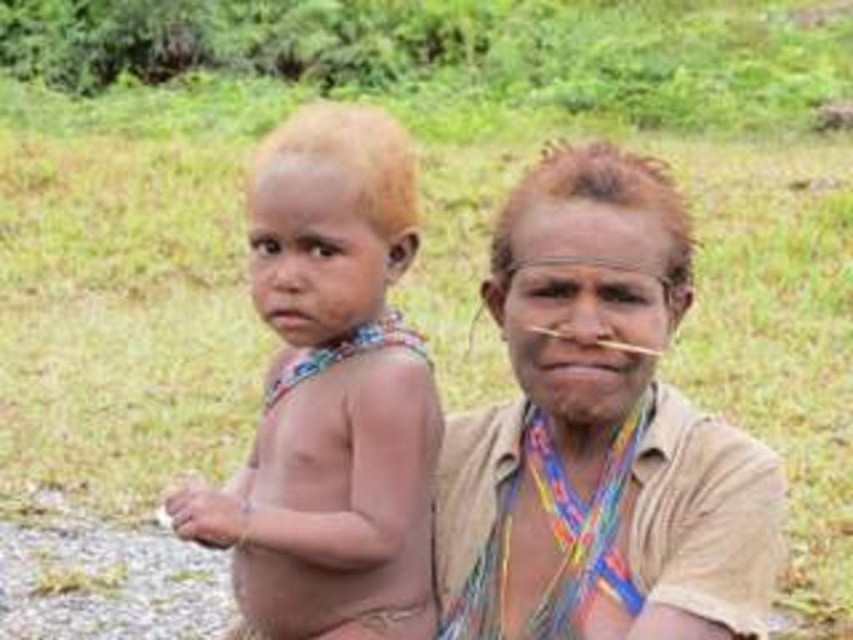
Question: Which of the following is the closest to the observer?

Choices:
 (A) 526,516
 (B) 369,588

Answer: (B)

Question: Does brown textured cloth at center have a greater width compared to light brown hair at center?

Choices:
 (A) no
 (B) yes

Answer: (B)

Question: Does brown textured cloth at center appear under light brown hair at center?

Choices:
 (A) no
 (B) yes

Answer: (B)

Question: Which point appears farthest from the camera in this image?

Choices:
 (A) (476, 419)
 (B) (279, 548)

Answer: (A)

Question: Is brown textured cloth at center bigger than light brown hair at center?

Choices:
 (A) yes
 (B) no

Answer: (A)